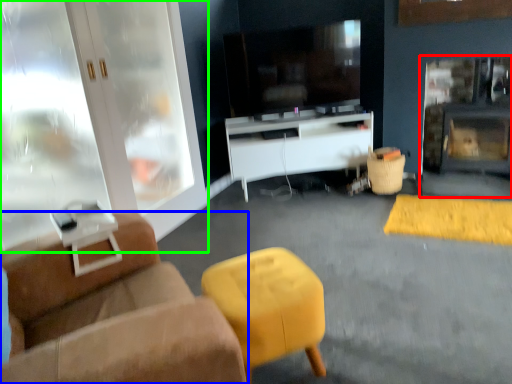
Question: Considering the real-world distances, which object is closest to fireplace (highlighted by a red box)? studio couch (highlighted by a blue box) or cabinetry (highlighted by a green box).

Choices:
 (A) studio couch
 (B) cabinetry

Answer: (B)